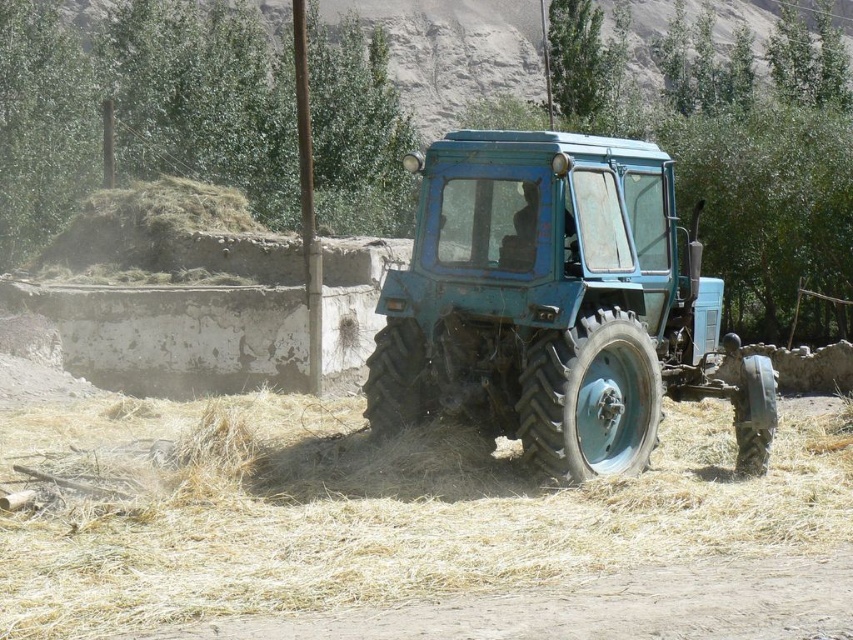
Question: Does blue matte tractor at center appear over dirt track at lower center?

Choices:
 (A) yes
 (B) no

Answer: (A)

Question: Is blue matte tractor at center positioned at the back of dirt track at lower center?

Choices:
 (A) yes
 (B) no

Answer: (A)

Question: Which of these objects is positioned farthest from the dirt track at lower center?

Choices:
 (A) dry straw at center
 (B) blue matte tractor at center

Answer: (B)

Question: Which of these objects is positioned farthest from the blue matte tractor at center?

Choices:
 (A) dirt track at lower center
 (B) dry straw at center

Answer: (A)

Question: Can you confirm if dry straw at center is bigger than blue matte tractor at center?

Choices:
 (A) no
 (B) yes

Answer: (B)

Question: Among these objects, which one is farthest from the camera?

Choices:
 (A) dry straw at center
 (B) dirt track at lower center
 (C) blue matte tractor at center

Answer: (C)